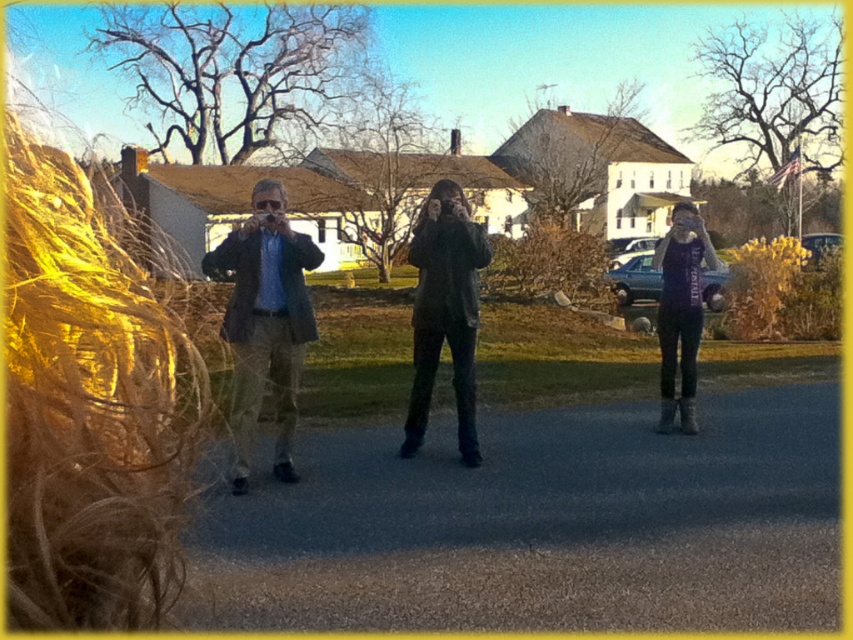
You are a delivery person trying to locate the dark gray fabric jacket at center. According to the coordinates provided, where exactly is the jacket positioned in the image?

The dark gray fabric jacket at center is located at point 0.487 on the x axis and 0.523 on the y axis.

You are a photographer trying to capture a group photo of the matte brown jacket at center and the purple jersey at center. Which clothing item will appear narrower in the photo?

The matte brown jacket at center will appear narrower in the photo because it has a lesser width compared to the purple jersey at center.

You are a photographer trying to capture a group photo of the matte brown jacket at center and the purple jersey at center. Which object should you focus on first if you want to ensure both are in frame without moving the camera?

The matte brown jacket at center occupies less space than the purple jersey at center, so you should focus on the purple jersey at center first to ensure it fits within the frame.